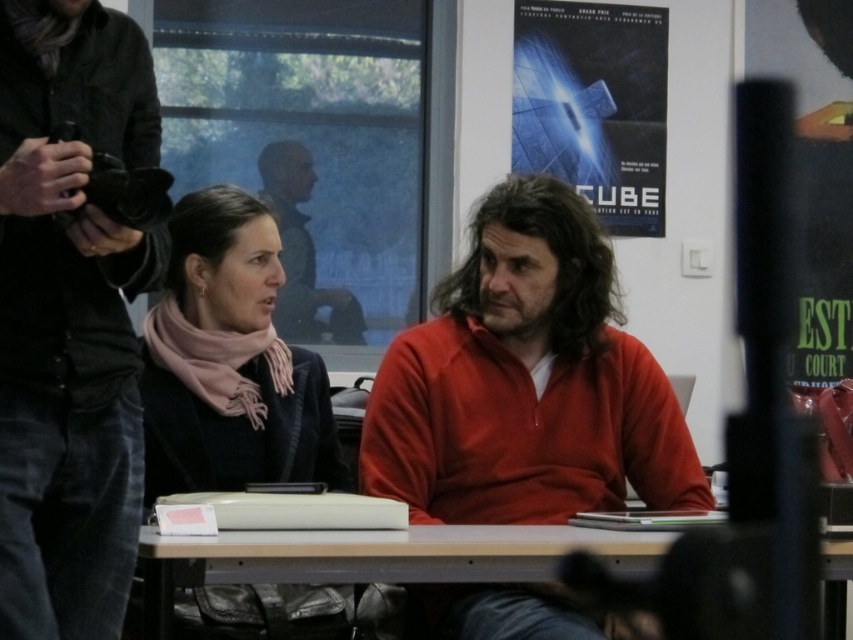
Question: Does wooden table at center appear under matte black jacket at upper center?

Choices:
 (A) no
 (B) yes

Answer: (B)

Question: Where is blue glossy poster at upper center located in relation to wooden table at center in the image?

Choices:
 (A) right
 (B) left

Answer: (A)

Question: Among these objects, which one is nearest to the camera?

Choices:
 (A) matte red sweater at center
 (B) dark gray corduroy jacket at left

Answer: (B)

Question: Is the position of pink scarf at center less distant than that of wooden table at center?

Choices:
 (A) no
 (B) yes

Answer: (A)

Question: Which point is closer to the camera taking this photo?

Choices:
 (A) (172, 260)
 (B) (492, 356)
 (C) (654, 65)

Answer: (A)

Question: Based on their relative distances, which object is nearer to the pink scarf at center?

Choices:
 (A) matte red sweater at center
 (B) matte black jacket at upper center
 (C) wooden table at center
 (D) dark gray corduroy jacket at left

Answer: (A)